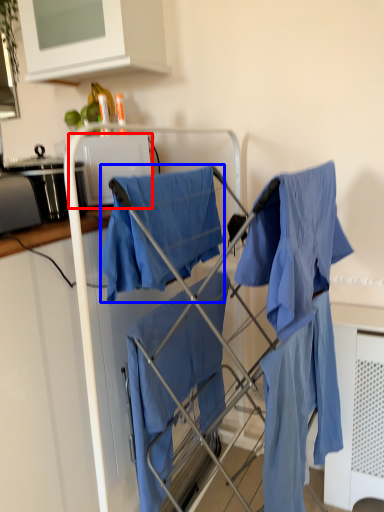
Question: Which object appears closest to the camera in this image, appliance (highlighted by a red box) or cloak (highlighted by a blue box)?

Choices:
 (A) appliance
 (B) cloak

Answer: (B)